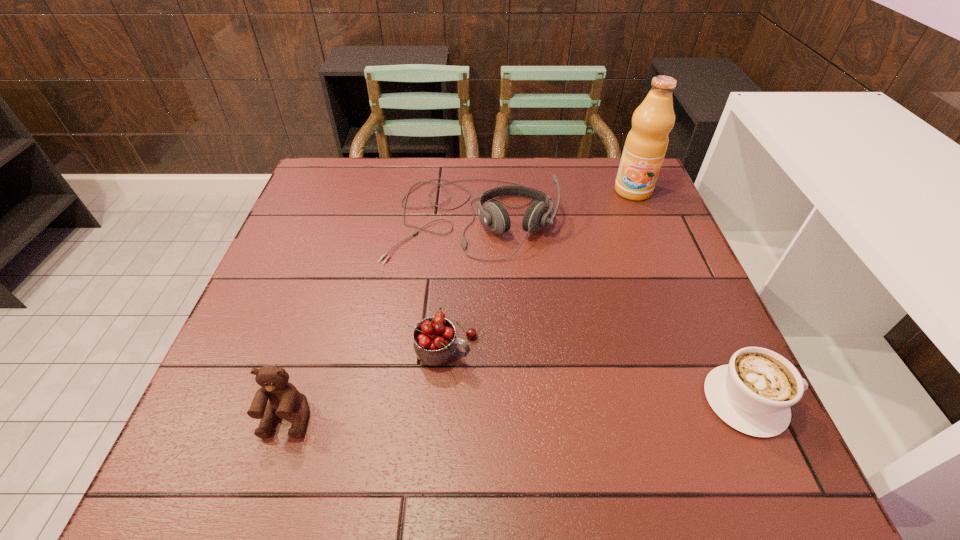
The width and height of the screenshot is (960, 540). Find the location of `cappuccino that is at the right edge`. cappuccino that is at the right edge is located at coordinates pos(753,393).

At what (x,y) coordinates should I click in order to perform the action: click on fruit juice situated at the right edge. Please return your answer as a coordinate pair (x, y). The height and width of the screenshot is (540, 960). Looking at the image, I should click on (646, 144).

You are a GUI agent. You are given a task and a screenshot of the screen. Output one action in this format:
    pyautogui.click(x=<x>, y=<y>)
    Task: Click on the object positioned at the near left corner
    This screenshot has width=960, height=540.
    Given the screenshot: What is the action you would take?
    pyautogui.click(x=284, y=398)

You are a GUI agent. You are given a task and a screenshot of the screen. Output one action in this format:
    pyautogui.click(x=<x>, y=<y>)
    Task: Click on the object that is at the far right corner
    This screenshot has height=540, width=960.
    Given the screenshot: What is the action you would take?
    pyautogui.click(x=646, y=144)

At what (x,y) coordinates should I click in order to perform the action: click on object at the near right corner. Please return your answer as a coordinate pair (x, y). Looking at the image, I should click on (753, 393).

The image size is (960, 540). I want to click on free space at the far edge, so click(368, 187).

In the image, there is a desktop. At what (x,y) coordinates should I click in order to perform the action: click on blank space at the near edge. Please return your answer as a coordinate pair (x, y). The width and height of the screenshot is (960, 540). Looking at the image, I should click on (516, 396).

This screenshot has width=960, height=540. Identify the location of vacant region at the left edge of the desktop. (308, 274).

The image size is (960, 540). I want to click on vacant point at the right edge, so click(x=662, y=224).

Identify the location of vacant space at the far left corner of the desktop. (346, 181).